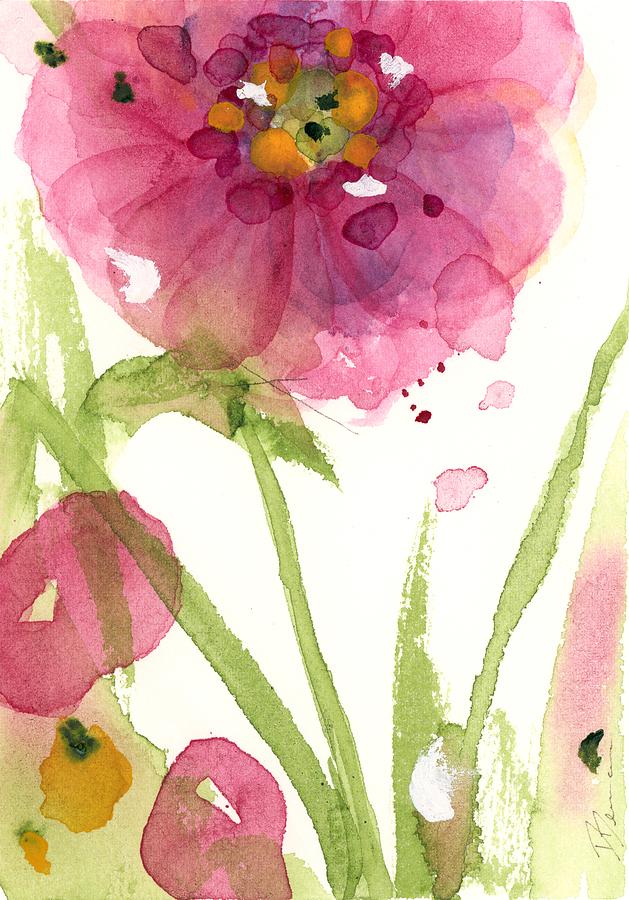
At what (x,y) coordinates should I click in order to perform the action: click on painting. Please return your answer as a coordinate pair (x, y). Looking at the image, I should click on (365, 486).